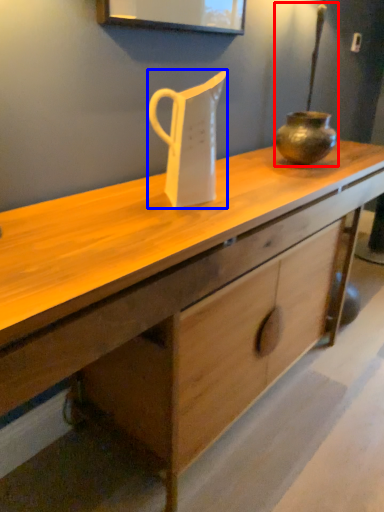
Question: Which object is closer to the camera taking this photo, candle holder (highlighted by a red box) or jug (highlighted by a blue box)?

Choices:
 (A) candle holder
 (B) jug

Answer: (B)